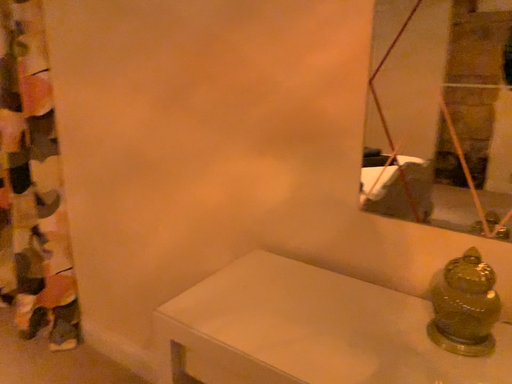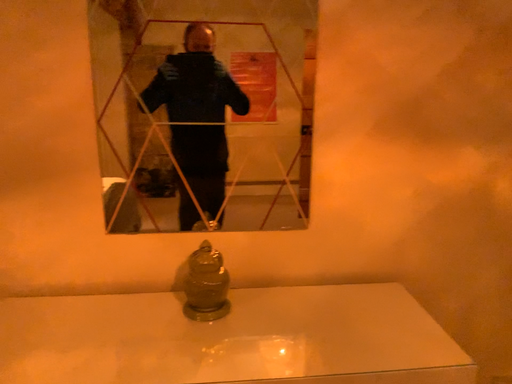
Question: How did the camera likely rotate when shooting the video?

Choices:
 (A) rotated downward
 (B) rotated upward

Answer: (B)